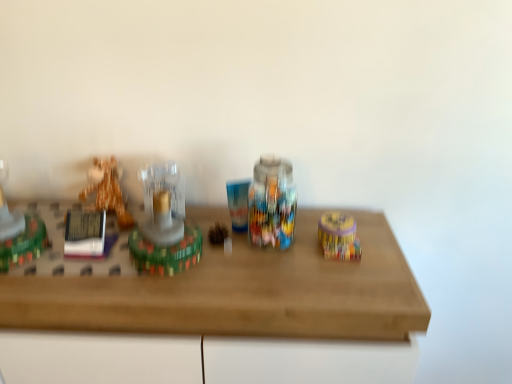
Where is `free space that is to the left of translucent glass candle at center, positioned as the second toy in right-to-left order`? This screenshot has width=512, height=384. free space that is to the left of translucent glass candle at center, positioned as the second toy in right-to-left order is located at coordinates (83, 273).